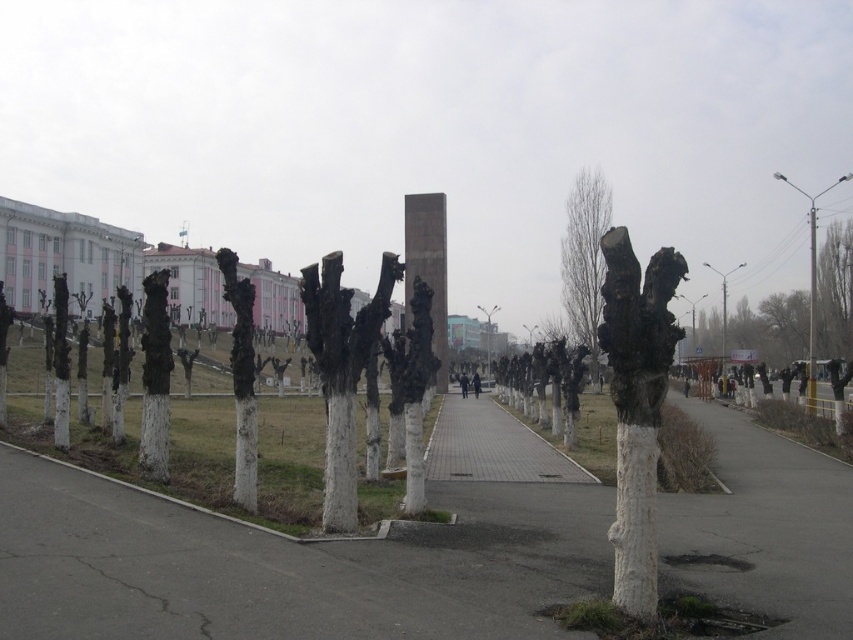
Question: Is white painted wood tree stump at right wider than black matte sculpture at center?

Choices:
 (A) no
 (B) yes

Answer: (B)

Question: Is white asphalt at center closer to camera compared to smooth white tree trunk at center?

Choices:
 (A) no
 (B) yes

Answer: (B)

Question: Estimate the real-world distances between objects in this image. Which object is closer to the white asphalt at center?

Choices:
 (A) smooth white tree trunk at center
 (B) smooth gray pole at right
 (C) white painted wood tree stump at right

Answer: (C)

Question: Can you confirm if white asphalt at center is positioned above smooth white tree trunk at center?

Choices:
 (A) no
 (B) yes

Answer: (A)

Question: Among these objects, which one is nearest to the camera?

Choices:
 (A) smooth gray pole at right
 (B) smooth white tree trunk at center
 (C) white painted wood tree stump at right
 (D) black matte sculpture at center

Answer: (C)

Question: Estimate the real-world distances between objects in this image. Which object is closer to the smooth gray pole at right?

Choices:
 (A) smooth bark tree at center
 (B) white asphalt at center
 (C) smooth white tree trunk at center

Answer: (A)